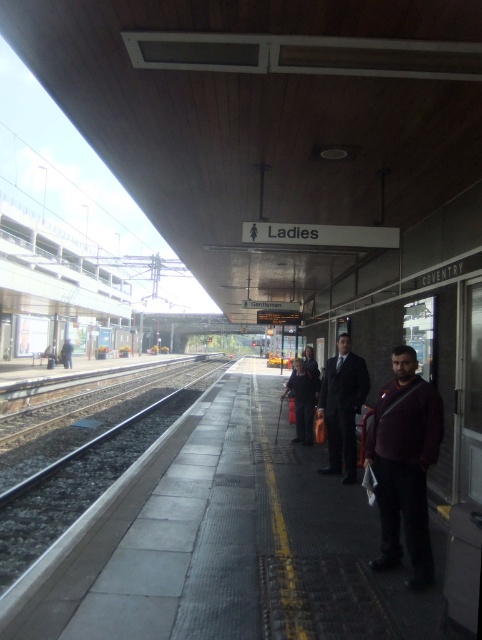
Question: Does maroon fabric jacket at center have a greater width compared to dark suit at center?

Choices:
 (A) no
 (B) yes

Answer: (A)

Question: Observing the image, what is the correct spatial positioning of maroon fabric jacket at center in reference to dark suit at center?

Choices:
 (A) above
 (B) below

Answer: (A)

Question: Is the position of maroon fabric jacket at center more distant than that of dark suit at center?

Choices:
 (A) yes
 (B) no

Answer: (B)

Question: Which of the following is the closest to the observer?

Choices:
 (A) dark suit at center
 (B) maroon fabric jacket at center

Answer: (B)

Question: Which of the following is the closest to the observer?

Choices:
 (A) maroon fabric jacket at center
 (B) dark suit at center

Answer: (A)

Question: Which of the following is the closest to the observer?

Choices:
 (A) dark suit at center
 (B) maroon fabric jacket at center

Answer: (B)